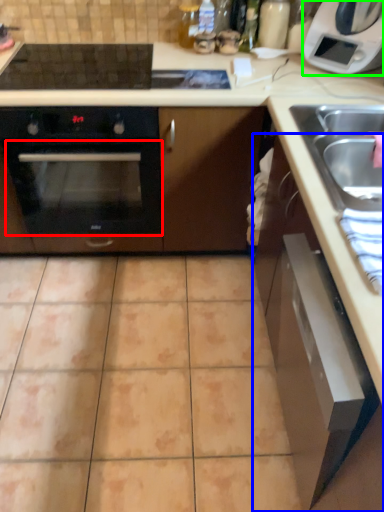
Question: Considering the real-world distances, which object is closest to oven (highlighted by a red box)? cabinetry (highlighted by a blue box) or home appliance (highlighted by a green box).

Choices:
 (A) cabinetry
 (B) home appliance

Answer: (A)